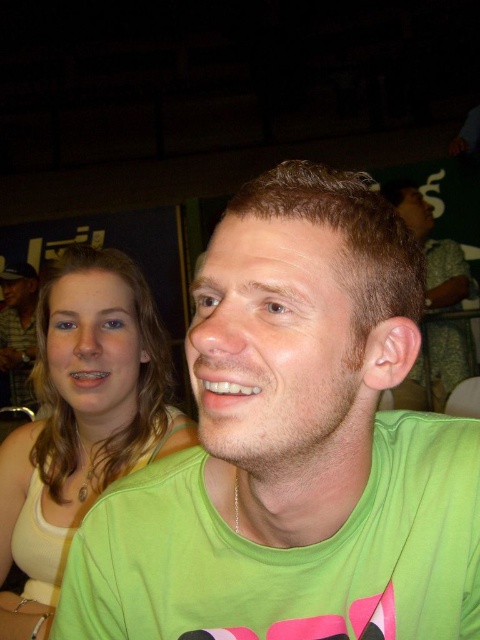
Question: Among these points, which one is nearest to the camera?

Choices:
 (A) (59, 513)
 (B) (205, 410)
 (C) (416, 186)

Answer: (B)

Question: Which object appears farthest from the camera in this image?

Choices:
 (A) matte green t-shirt at upper left
 (B) light beige tank top at upper left
 (C) green matte shirt at center

Answer: (A)

Question: Can you confirm if light beige tank top at upper left is positioned below matte green t-shirt at upper left?

Choices:
 (A) yes
 (B) no

Answer: (A)

Question: Which point is farther to the camera?

Choices:
 (A) green fabric shirt at center
 (B) light beige tank top at upper left
 (C) matte green t-shirt at upper left

Answer: (C)

Question: Is green fabric shirt at center above light beige tank top at upper left?

Choices:
 (A) no
 (B) yes

Answer: (B)

Question: Does light beige tank top at upper left appear on the left side of green matte shirt at center?

Choices:
 (A) no
 (B) yes

Answer: (B)